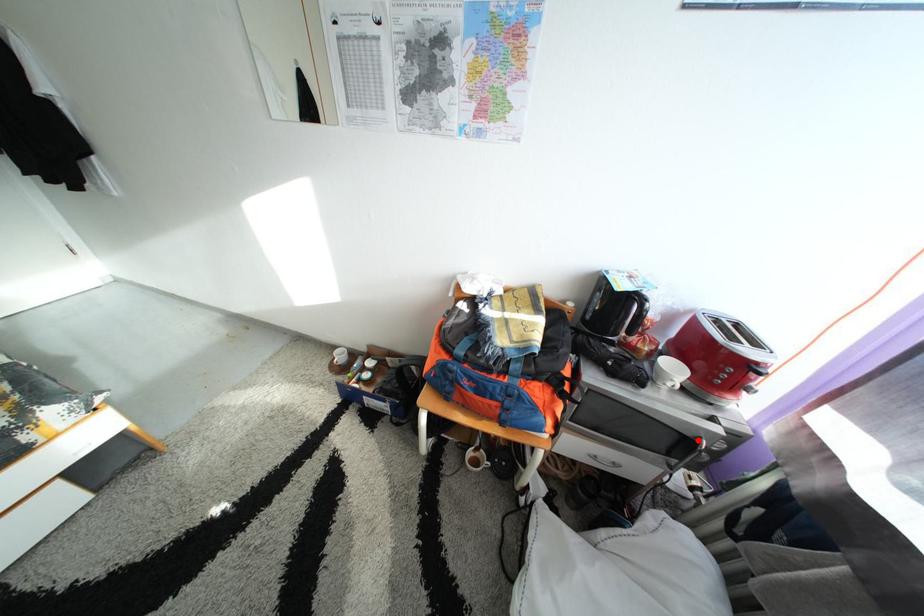
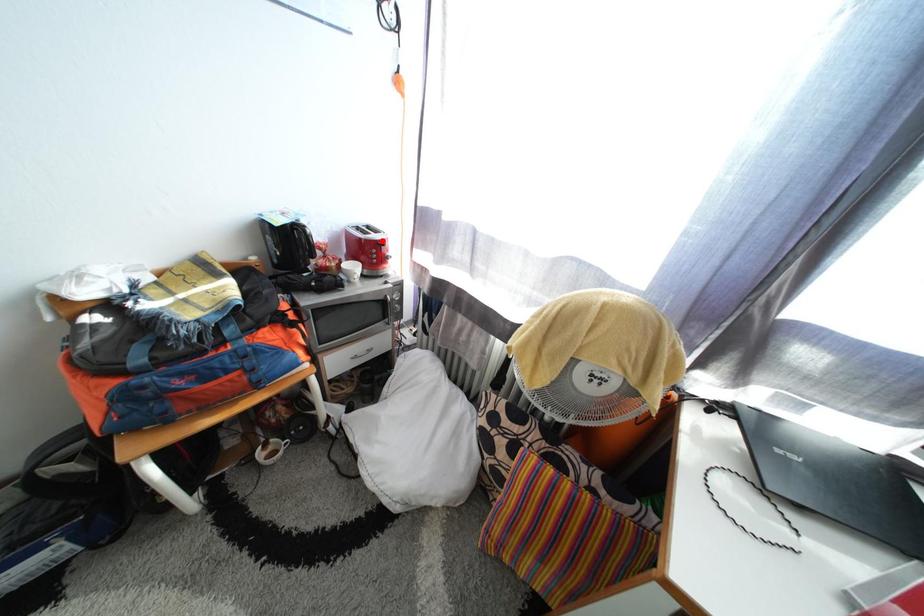
I am providing you with two images of the same scene from different viewpoints. A red point is marked on the first image and another point is marked on the second image. Is the marked point in image1 the same physical position as the marked point in image2?

No